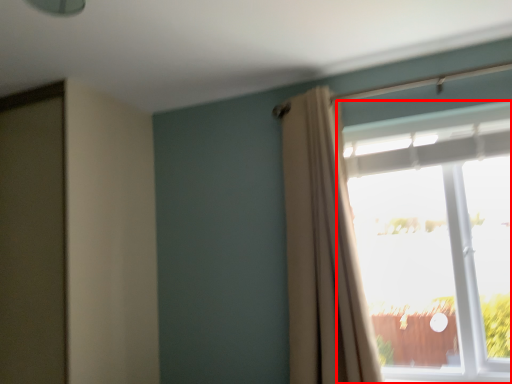
Question: From the image's perspective, where is window (annotated by the red box) located relative to curtain?

Choices:
 (A) below
 (B) above

Answer: (A)